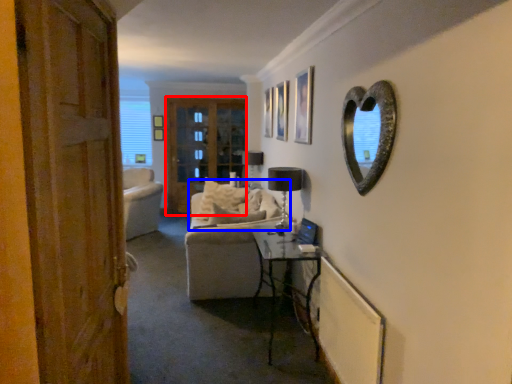
Question: Which of the following is the farthest to the observer, screen door (highlighted by a red box) or couch (highlighted by a blue box)?

Choices:
 (A) screen door
 (B) couch

Answer: (A)